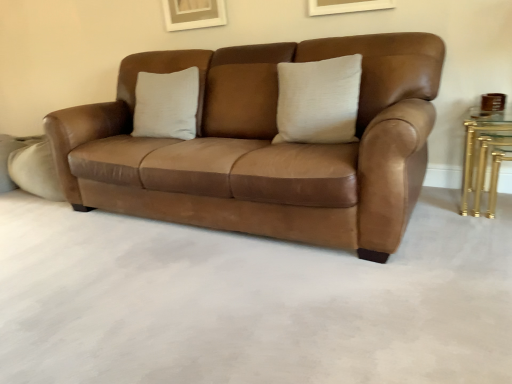
Locate an element on the screen. This screenshot has height=384, width=512. gold metallic table at right is located at coordinates (481, 151).

From the picture: What is the approximate width of gold metallic table at right?

gold metallic table at right is 16.38 inches wide.

Locate an element on the screen. satin beige pillow at center is located at coordinates (318, 100).

The image size is (512, 384). I want to click on suede leather couch at center, so click(264, 147).

Based on the photo, is gold metallic table at right far away from suede leather couch at center?

No, gold metallic table at right is not far from suede leather couch at center.

Based on the photo, which of these two, gold metallic table at right or suede leather couch at center, is thinner?

With smaller width is gold metallic table at right.

Is suede leather couch at center situated inside satin beige pillow at center or outside?

suede leather couch at center is not inside satin beige pillow at center, it's outside.

How different are the orientations of suede leather couch at center and satin beige pillow at center in degrees?

The angle between the facing direction of suede leather couch at center and the facing direction of satin beige pillow at center is 0.000816 degrees.

Is suede leather couch at center oriented towards satin beige pillow at center?

Yes, suede leather couch at center is turned towards satin beige pillow at center.

Between suede leather couch at center and satin beige pillow at center, which one is positioned behind?

satin beige pillow at center is more distant.

Do you think suede leather couch at center is within gold metallic table at right, or outside of it?

suede leather couch at center is not inside gold metallic table at right, it's outside.

Is suede leather couch at center turned away from gold metallic table at right?

That's not correct — suede leather couch at center is not looking away from gold metallic table at right.

Does suede leather couch at center have a smaller size compared to gold metallic table at right?

Incorrect, suede leather couch at center is not smaller in size than gold metallic table at right.

Is suede leather couch at center not close to gold metallic table at right?

They are positioned close to each other.

Which of these two, satin beige pillow at center or gold metallic table at right, is wider?

gold metallic table at right is wider.

How much distance is there between satin beige pillow at center and gold metallic table at right?

The distance of satin beige pillow at center from gold metallic table at right is 73.92 centimeters.

Who is smaller, satin beige pillow at center or gold metallic table at right?

Smaller between the two is gold metallic table at right.

How different are the orientations of satin beige pillow at center and gold metallic table at right in degrees?

The facing directions of satin beige pillow at center and gold metallic table at right are 0.000905 degrees apart.

Considering the relative sizes of satin beige pillow at center and suede leather couch at center in the image provided, is satin beige pillow at center smaller than suede leather couch at center?

Yes.

From a real-world perspective, is satin beige pillow at center physically below suede leather couch at center?

No, from a real-world perspective, satin beige pillow at center is not below suede leather couch at center.

Between satin beige pillow at center and suede leather couch at center, which one appears on the left side from the viewer's perspective?

Positioned to the left is suede leather couch at center.

From the image's perspective, is satin beige pillow at center located above or below suede leather couch at center?

From the image's perspective, satin beige pillow at center appears above suede leather couch at center.

Which object is wider, gold metallic table at right or satin beige pillow at center?

gold metallic table at right.

Can you confirm if gold metallic table at right is positioned to the right of satin beige pillow at center?

Yes, gold metallic table at right is to the right of satin beige pillow at center.

From a real-world perspective, who is located lower, gold metallic table at right or satin beige pillow at center?

gold metallic table at right is physically lower.

Does point (485, 111) come behind point (283, 100)?

No, (485, 111) is in front of (283, 100).

You are a GUI agent. You are given a task and a screenshot of the screen. Output one action in this format:
    pyautogui.click(x=<x>, y=<y>)
    Task: Click on the table behind the suede leather couch at center
    This screenshot has height=384, width=512.
    Given the screenshot: What is the action you would take?
    pyautogui.click(x=481, y=151)

At what (x,y) coordinates should I click in order to perform the action: click on pillow on the right of suede leather couch at center. Please return your answer as a coordinate pair (x, y). The height and width of the screenshot is (384, 512). Looking at the image, I should click on (318, 100).

Consider the image. Considering their positions, is suede leather couch at center positioned further to gold metallic table at right than satin beige pillow at center?

suede leather couch at center is further to gold metallic table at right.

Estimate the real-world distances between objects in this image. Which object is closer to satin beige pillow at center, gold metallic table at right or suede leather couch at center?

suede leather couch at center.

When comparing their distances from suede leather couch at center, does gold metallic table at right or satin beige pillow at center seem further?

gold metallic table at right is positioned further to the anchor suede leather couch at center.

Based on their spatial positions, is satin beige pillow at center or suede leather couch at center closer to gold metallic table at right?

satin beige pillow at center lies closer to gold metallic table at right than the other object.

From the image, which object appears to be farther from suede leather couch at center, satin beige pillow at center or gold metallic table at right?

Based on the image, gold metallic table at right appears to be further to suede leather couch at center.

Looking at the image, which one is located further to satin beige pillow at center, suede leather couch at center or gold metallic table at right?

Among the two, gold metallic table at right is located further to satin beige pillow at center.

Where is `pillow located between suede leather couch at center and gold metallic table at right in the left-right direction`? pillow located between suede leather couch at center and gold metallic table at right in the left-right direction is located at coordinates (318, 100).